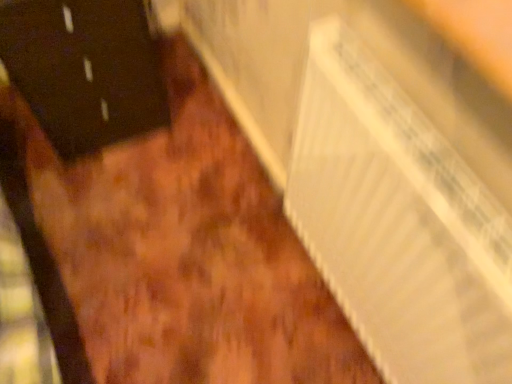
Image resolution: width=512 pixels, height=384 pixels. What do you see at coordinates (85, 70) in the screenshot?
I see `black matte door at left` at bounding box center [85, 70].

Measure the distance between point [141,90] and camera.

Point [141,90] is 4.38 feet away from camera.

At what (x,y) coordinates should I click in order to perform the action: click on black matte door at left. Please return your answer as a coordinate pair (x, y). Looking at the image, I should click on (85, 70).

This screenshot has height=384, width=512. What do you see at coordinates (398, 222) in the screenshot?
I see `white cardboard radiator at lower right` at bounding box center [398, 222].

The width and height of the screenshot is (512, 384). Find the location of `white cardboard radiator at lower right`. white cardboard radiator at lower right is located at coordinates (398, 222).

Where is `black matte door at left`? black matte door at left is located at coordinates (85, 70).

Considering the relative positions of black matte door at left and white cardboard radiator at lower right in the image provided, is black matte door at left to the left or to the right of white cardboard radiator at lower right?

Clearly, black matte door at left is on the left of white cardboard radiator at lower right in the image.

Relative to white cardboard radiator at lower right, is black matte door at left in front or behind?

black matte door at left is behind white cardboard radiator at lower right.

Considering the positions of point (167, 110) and point (357, 200), is point (167, 110) closer or farther from the camera than point (357, 200)?

Point (167, 110).

In the scene shown: From the image's perspective, which one is positioned lower, black matte door at left or white cardboard radiator at lower right?

white cardboard radiator at lower right.

From a real-world perspective, between black matte door at left and white cardboard radiator at lower right, who is vertically higher?

white cardboard radiator at lower right, from a real-world perspective.

Which of these two, black matte door at left or white cardboard radiator at lower right, is wider?

black matte door at left is wider.

Is black matte door at left taller or shorter than white cardboard radiator at lower right?

Considering their sizes, black matte door at left has more height than white cardboard radiator at lower right.

Considering the relative sizes of black matte door at left and white cardboard radiator at lower right in the image provided, is black matte door at left smaller than white cardboard radiator at lower right?

Actually, black matte door at left might be larger than white cardboard radiator at lower right.

Would you say black matte door at left is outside white cardboard radiator at lower right?

Yes, black matte door at left is located beyond the bounds of white cardboard radiator at lower right.

Is black matte door at left touching white cardboard radiator at lower right?

There is a gap between black matte door at left and white cardboard radiator at lower right.

Is black matte door at left positioned with its back to white cardboard radiator at lower right?

No, black matte door at left's orientation is not away from white cardboard radiator at lower right.

Can you tell me how much black matte door at left and white cardboard radiator at lower right differ in facing direction?

The facing directions of black matte door at left and white cardboard radiator at lower right are 89.7 degrees apart.

Find the location of a particular element. radiator located below the black matte door at left (from the image's perspective) is located at coordinates (x=398, y=222).

Which object is positioned more to the left, white cardboard radiator at lower right or black matte door at left?

black matte door at left.

Is white cardboard radiator at lower right further to the viewer compared to black matte door at left?

No, it is not.

Which is behind, point (490, 342) or point (115, 22)?

The point (115, 22) is farther from the camera.

From the image's perspective, is white cardboard radiator at lower right located above or below black matte door at left?

Based on their image positions, white cardboard radiator at lower right is located beneath black matte door at left.

From a real-world perspective, between white cardboard radiator at lower right and black matte door at left, who is vertically lower?

black matte door at left, from a real-world perspective.

Consider the image. Considering the relative sizes of white cardboard radiator at lower right and black matte door at left in the image provided, is white cardboard radiator at lower right thinner than black matte door at left?

Yes.

From their relative heights in the image, would you say white cardboard radiator at lower right is taller or shorter than black matte door at left?

white cardboard radiator at lower right is shorter than black matte door at left.

Which of these two, white cardboard radiator at lower right or black matte door at left, is bigger?

black matte door at left.

Could black matte door at left be considered to be inside white cardboard radiator at lower right?

No, black matte door at left is not inside white cardboard radiator at lower right.

Are white cardboard radiator at lower right and black matte door at left beside each other?

No, white cardboard radiator at lower right is not next to black matte door at left.

Is white cardboard radiator at lower right turned away from black matte door at left?

white cardboard radiator at lower right is not turned away from black matte door at left.

Locate an element on the screen. Image resolution: width=512 pixels, height=384 pixels. door on the left side of white cardboard radiator at lower right is located at coordinates (85, 70).

The image size is (512, 384). What are the coordinates of `door behind the white cardboard radiator at lower right` in the screenshot? It's located at (85, 70).

The width and height of the screenshot is (512, 384). I want to click on radiator located below the black matte door at left (from the image's perspective), so click(398, 222).